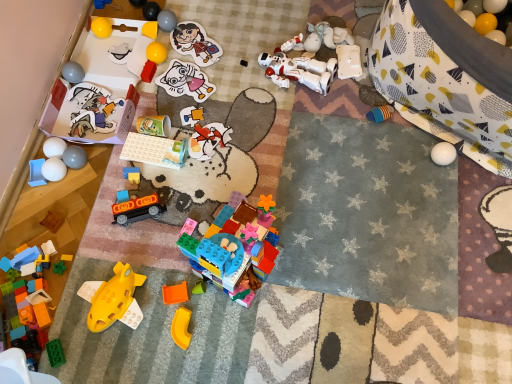
The width and height of the screenshot is (512, 384). Find the location of `vacant area in front of matte paper sticker at upper center, which is counted as the twentieth toy, starting from the left`. vacant area in front of matte paper sticker at upper center, which is counted as the twentieth toy, starting from the left is located at coordinates (192, 90).